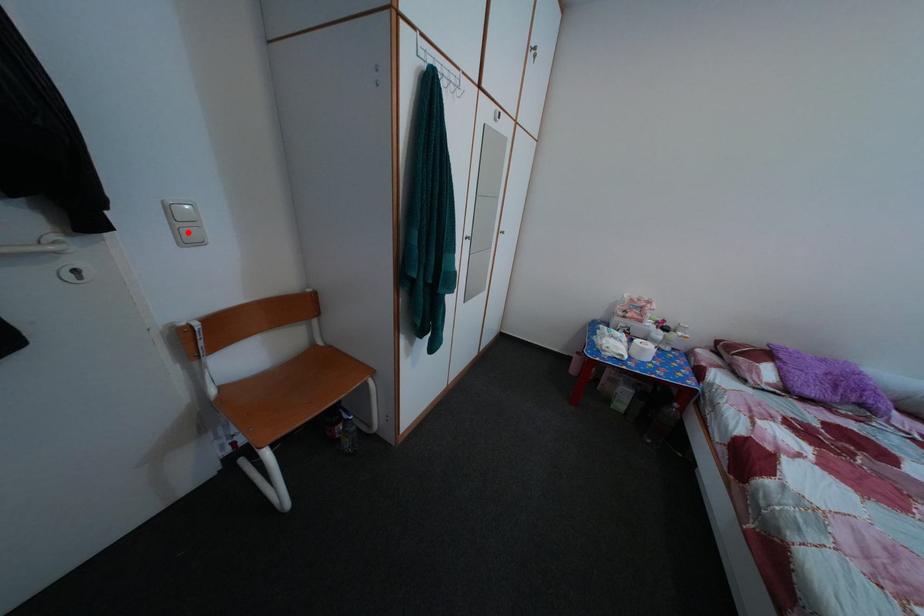
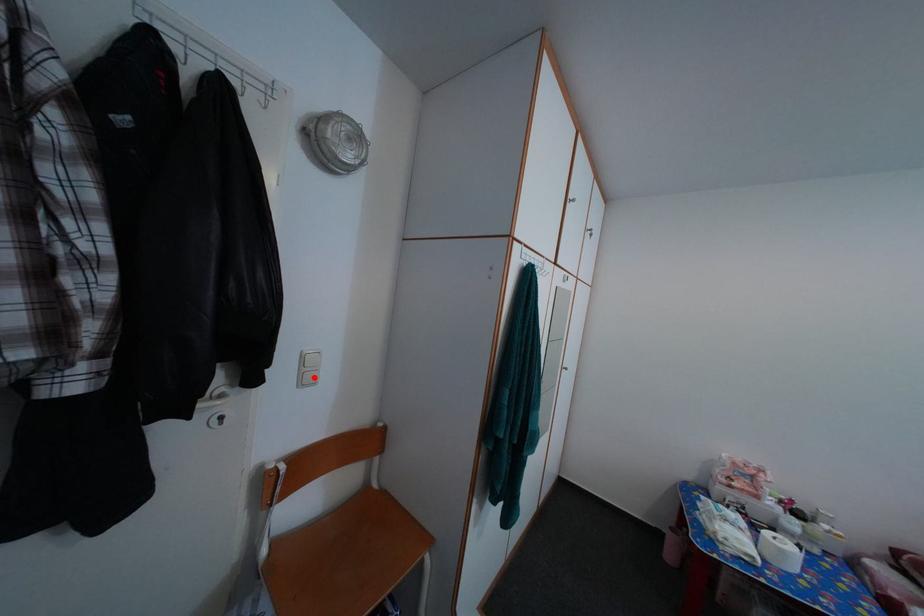
I am providing you with two images of the same scene from different viewpoints. A red point is marked on the first image and another point is marked on the second image. Is the red point in image1 aligned with the point shown in image2?

Yes